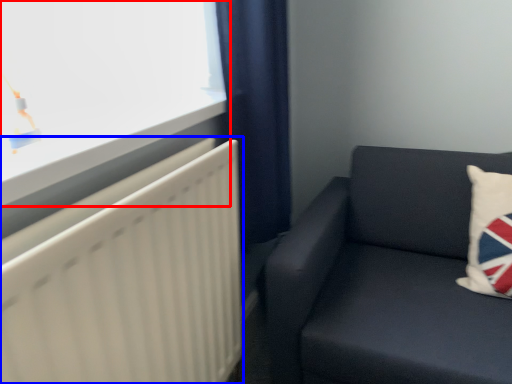
Question: Which object is further to the camera taking this photo, window (highlighted by a red box) or radiator (highlighted by a blue box)?

Choices:
 (A) window
 (B) radiator

Answer: (A)